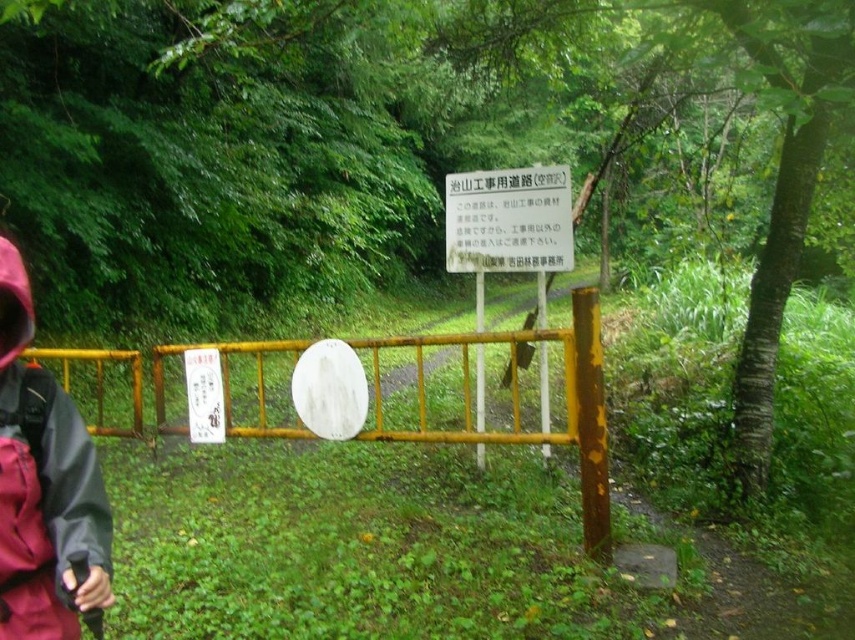
Question: Which object appears farthest from the camera in this image?

Choices:
 (A) red waterproof jacket at left
 (B) white paper sign at center

Answer: (B)

Question: Does red waterproof jacket at left appear over white paper sign at center?

Choices:
 (A) yes
 (B) no

Answer: (B)

Question: Where is red waterproof jacket at left located in relation to white paper sign at center in the image?

Choices:
 (A) right
 (B) left

Answer: (B)

Question: Can you confirm if red waterproof jacket at left is positioned to the right of white paper sign at center?

Choices:
 (A) yes
 (B) no

Answer: (B)